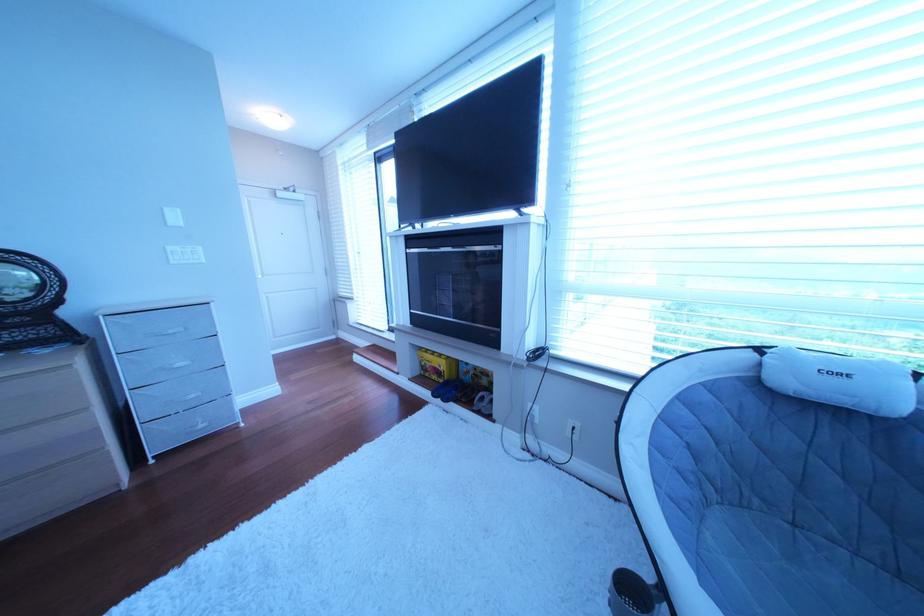
Describe the element at coordinates (172, 217) in the screenshot. I see `the white light switch` at that location.